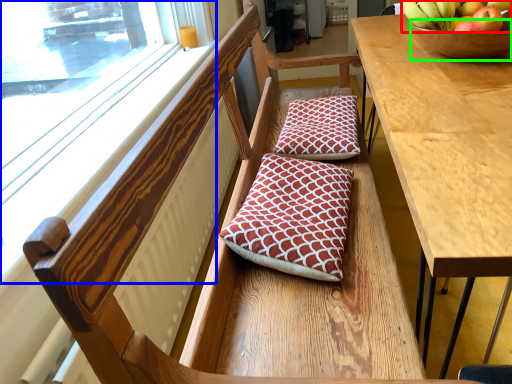
Question: Estimate the real-world distances between objects in this image. Which object is farther from banana (highlighted by a red box), window (highlighted by a blue box) or glass bowl (highlighted by a green box)?

Choices:
 (A) window
 (B) glass bowl

Answer: (A)